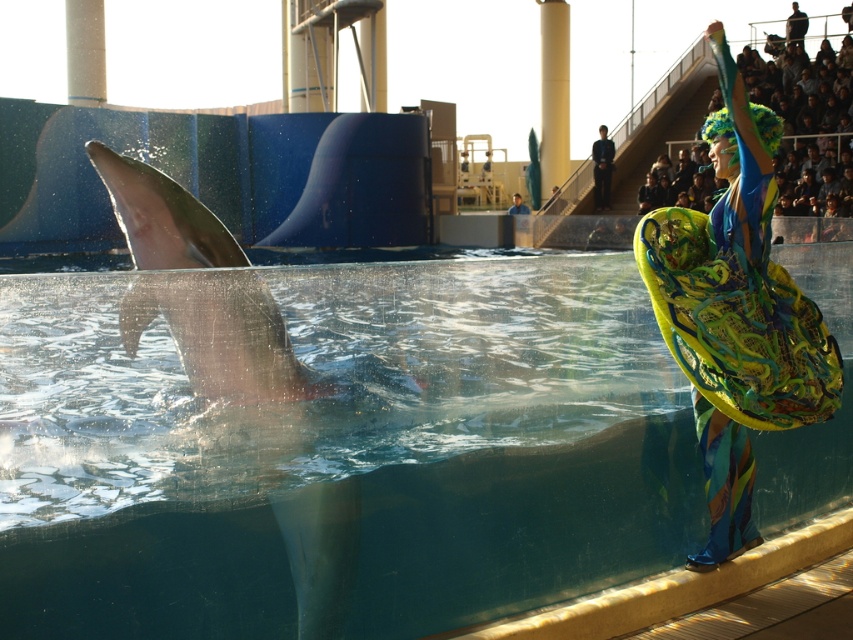
Is transparent glass pool at center taller than smooth gray dolphin at left?

Yes, transparent glass pool at center is taller than smooth gray dolphin at left.

Does point (0, 413) lie in front of point (141, 276)?

Yes, point (0, 413) is in front of point (141, 276).

Locate an element on the screen. The image size is (853, 640). transparent glass pool at center is located at coordinates (341, 454).

At what (x,y) coordinates should I click in order to perform the action: click on multicolored fabric fan at right. Please return your answer as a coordinate pair (x, y). Looking at the image, I should click on tap(735, 314).

Who is more distant from viewer, (x=759, y=339) or (x=187, y=316)?

Point (x=759, y=339)

Locate an element on the screen. multicolored fabric fan at right is located at coordinates (735, 314).

Between point (701, 528) and point (596, 208), which one is positioned in front?

Point (701, 528)

Does transparent glass pool at center appear on the left side of black smooth suit at upper center?

Indeed, transparent glass pool at center is positioned on the left side of black smooth suit at upper center.

Locate an element on the screen. This screenshot has height=640, width=853. transparent glass pool at center is located at coordinates (341, 454).